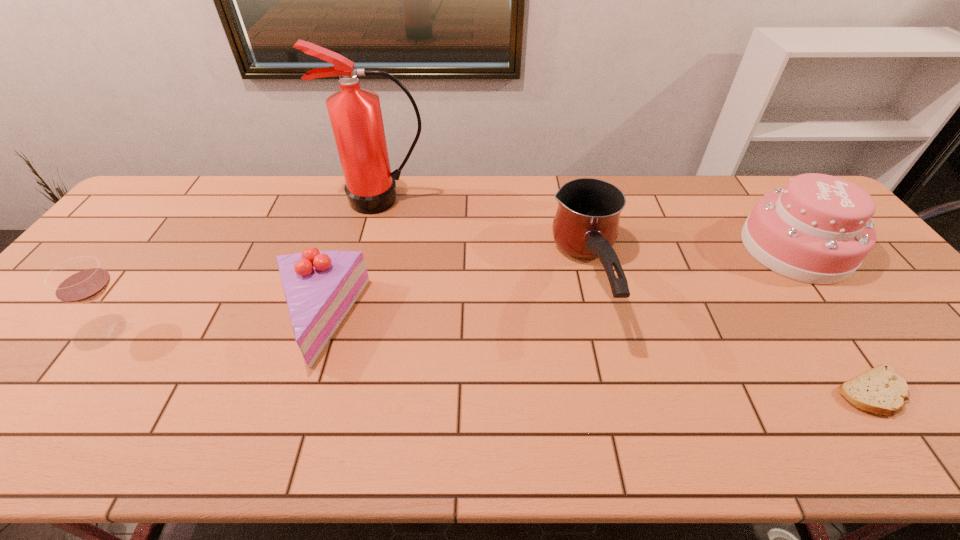
In order to click on fire extinguisher in this screenshot , I will do `click(355, 114)`.

Locate an element on the screen. The height and width of the screenshot is (540, 960). the tallest object is located at coordinates (355, 114).

Image resolution: width=960 pixels, height=540 pixels. What are the coordinates of `the taller cake` in the screenshot? It's located at (817, 230).

Identify the location of saucepan. (586, 225).

Identify the location of the leftmost object. (81, 280).

This screenshot has width=960, height=540. Find the location of `the shorter cake`. the shorter cake is located at coordinates (320, 287).

Where is `the left cake`? Image resolution: width=960 pixels, height=540 pixels. the left cake is located at coordinates (320, 287).

This screenshot has width=960, height=540. Identify the location of the shortest object. (880, 390).

Where is `vacant space located 0.200m at the spray nozzle of the tallest object`? vacant space located 0.200m at the spray nozzle of the tallest object is located at coordinates (368, 259).

The width and height of the screenshot is (960, 540). I want to click on free region located on the front of the taller cake, so click(x=849, y=320).